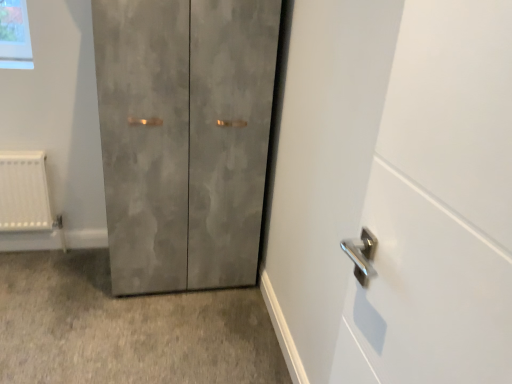
Question: Is matte gray cabinet at center positioned behind concrete textured cabinet at lower left?

Choices:
 (A) yes
 (B) no

Answer: (A)

Question: Considering the relative sizes of matte gray cabinet at center and concrete textured cabinet at lower left in the image provided, is matte gray cabinet at center thinner than concrete textured cabinet at lower left?

Choices:
 (A) yes
 (B) no

Answer: (A)

Question: Does matte gray cabinet at center appear on the left side of concrete textured cabinet at lower left?

Choices:
 (A) yes
 (B) no

Answer: (B)

Question: From a real-world perspective, is matte gray cabinet at center over concrete textured cabinet at lower left?

Choices:
 (A) yes
 (B) no

Answer: (A)

Question: Is matte gray cabinet at center shorter than concrete textured cabinet at lower left?

Choices:
 (A) no
 (B) yes

Answer: (A)

Question: Is matte gray cabinet at center beside concrete textured cabinet at lower left?

Choices:
 (A) no
 (B) yes

Answer: (A)

Question: Is concrete textured cabinet at lower left thinner than matte gray cabinet at center?

Choices:
 (A) yes
 (B) no

Answer: (B)

Question: From a real-world perspective, is concrete textured cabinet at lower left positioned over matte gray cabinet at center based on gravity?

Choices:
 (A) no
 (B) yes

Answer: (A)

Question: From a real-world perspective, does concrete textured cabinet at lower left sit lower than matte gray cabinet at center?

Choices:
 (A) yes
 (B) no

Answer: (A)

Question: Does concrete textured cabinet at lower left lie behind matte gray cabinet at center?

Choices:
 (A) no
 (B) yes

Answer: (A)

Question: Considering the relative sizes of concrete textured cabinet at lower left and matte gray cabinet at center in the image provided, is concrete textured cabinet at lower left smaller than matte gray cabinet at center?

Choices:
 (A) no
 (B) yes

Answer: (B)

Question: Can you confirm if concrete textured cabinet at lower left is bigger than matte gray cabinet at center?

Choices:
 (A) no
 (B) yes

Answer: (A)

Question: Is matte gray cabinet at center inside or outside of concrete textured cabinet at lower left?

Choices:
 (A) outside
 (B) inside

Answer: (A)